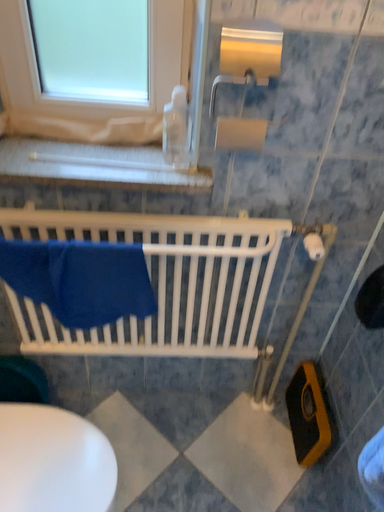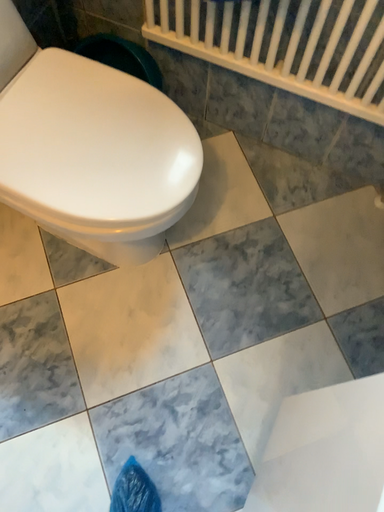
Question: Which way did the camera rotate in the video?

Choices:
 (A) rotated right
 (B) rotated left

Answer: (B)